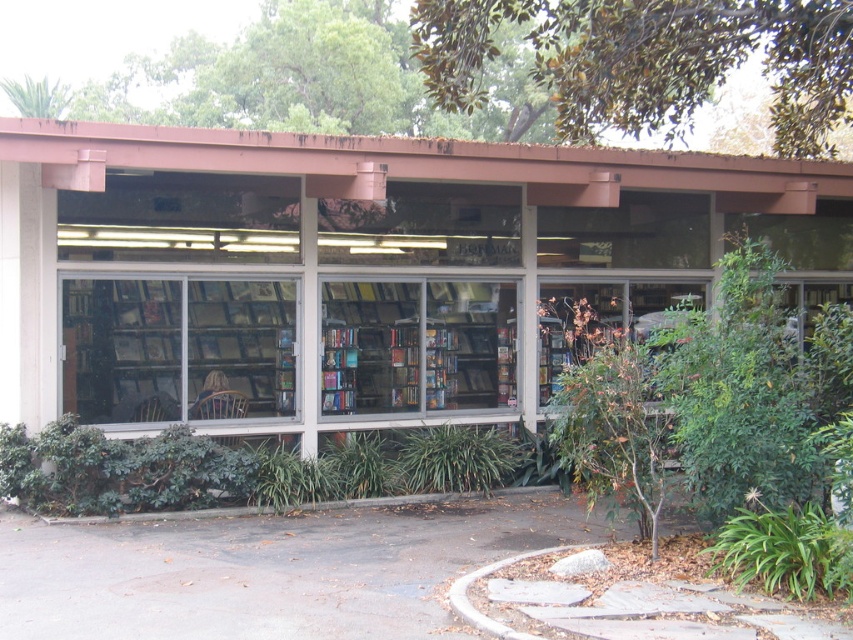
You are a delivery person trying to place a large package in front of the bookstore. The package is 1.2 meters tall. You see the clear glass bookshelf at center and the green leafy bush at center. Which object is closer to the ground, and can you place the package between them?

The clear glass bookshelf at center is located below green leafy bush at center, so it is closer to the ground. Since the package is 1.2 meters tall, you can place it between them as long as there is enough space horizontally.

You are a delivery person trying to unload a large box that is 2 meters tall. You need to bring it into the bookstore through the entrance. Based on the clear glass windows at center and the wooden bookshelf at center, which object should you avoid hitting the box against to prevent damage?

The clear glass windows at center is much taller than the wooden bookshelf at center, so you should avoid hitting the box against the clear glass windows at center since they are taller and might be more fragile.